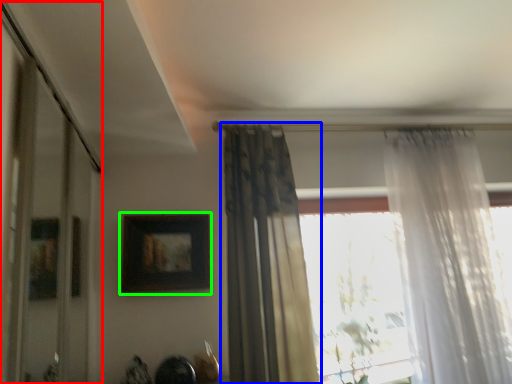
Question: Based on their relative distances, which object is nearer to glass door (highlighted by a red box)? Choose from curtain (highlighted by a blue box) and picture frame (highlighted by a green box).

Choices:
 (A) curtain
 (B) picture frame

Answer: (B)